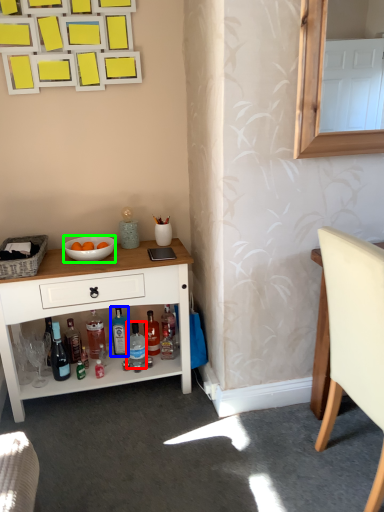
Question: Which object is the farthest from bottle (highlighted by a red box)? Choose among these: bottle (highlighted by a blue box) or bowl (highlighted by a green box).

Choices:
 (A) bottle
 (B) bowl

Answer: (B)